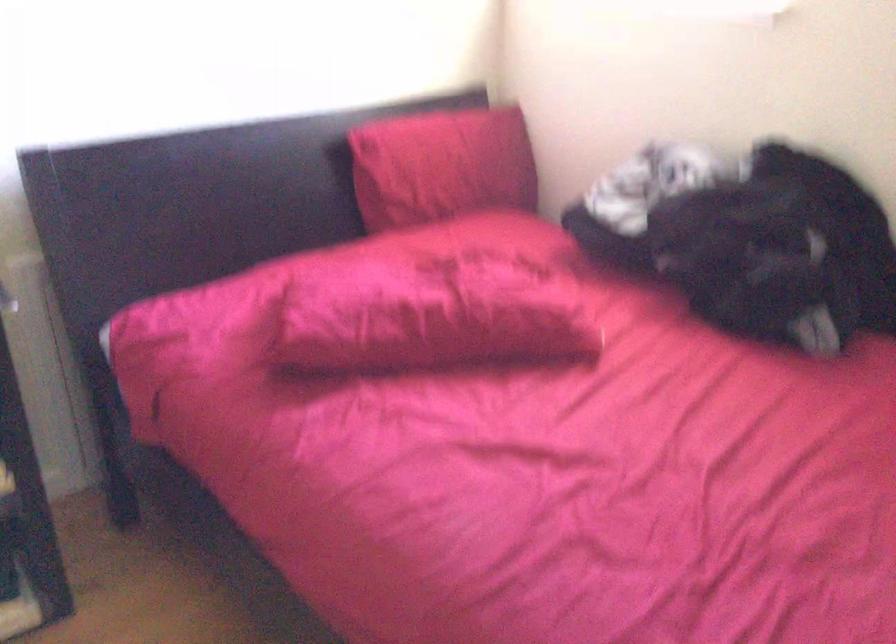
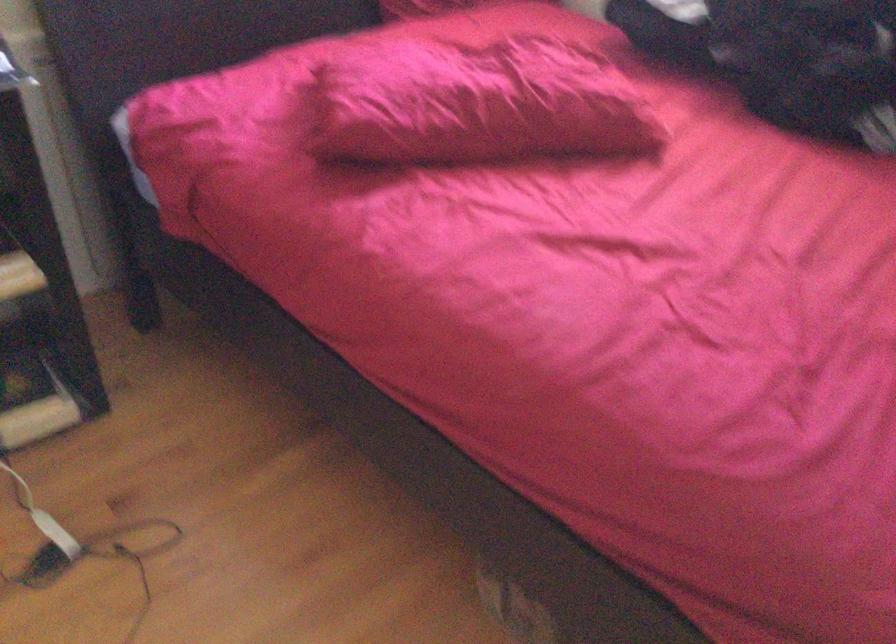
Question: Which direction would the cameraman need to move to produce the second image? Reply with the corresponding letter.

Choices:
 (A) Left
 (B) Right
 (C) Forward
 (D) Backward

Answer: (A)